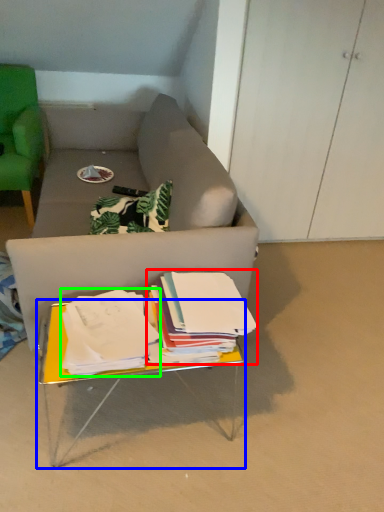
Question: Estimate the real-world distances between objects in this image. Which object is farther from paperback book (highlighted by a red box), table (highlighted by a blue box) or paperback book (highlighted by a green box)?

Choices:
 (A) table
 (B) paperback book

Answer: (A)